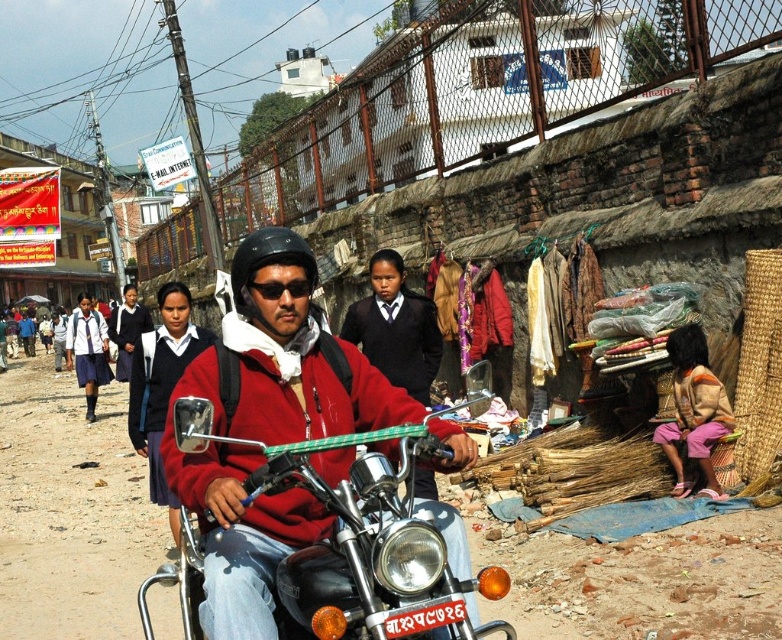
Question: Is matte black helmet at upper center above white uniform at center?

Choices:
 (A) yes
 (B) no

Answer: (B)

Question: Is white uniform at center bigger than black matte goggles at center?

Choices:
 (A) no
 (B) yes

Answer: (B)

Question: Which object appears closest to the camera in this image?

Choices:
 (A) brown woven basket at lower right
 (B) matte black helmet at upper center
 (C) black matte goggles at center

Answer: (C)

Question: Which of the following is the closest to the observer?

Choices:
 (A) matte black helmet at upper center
 (B) white uniform at center
 (C) brown woven basket at lower right

Answer: (A)

Question: Can you confirm if matte black helmet at upper center is positioned above brown woven basket at lower right?

Choices:
 (A) no
 (B) yes

Answer: (B)

Question: Which point appears farthest from the camera in this image?

Choices:
 (A) (273, 288)
 (B) (99, 346)

Answer: (B)